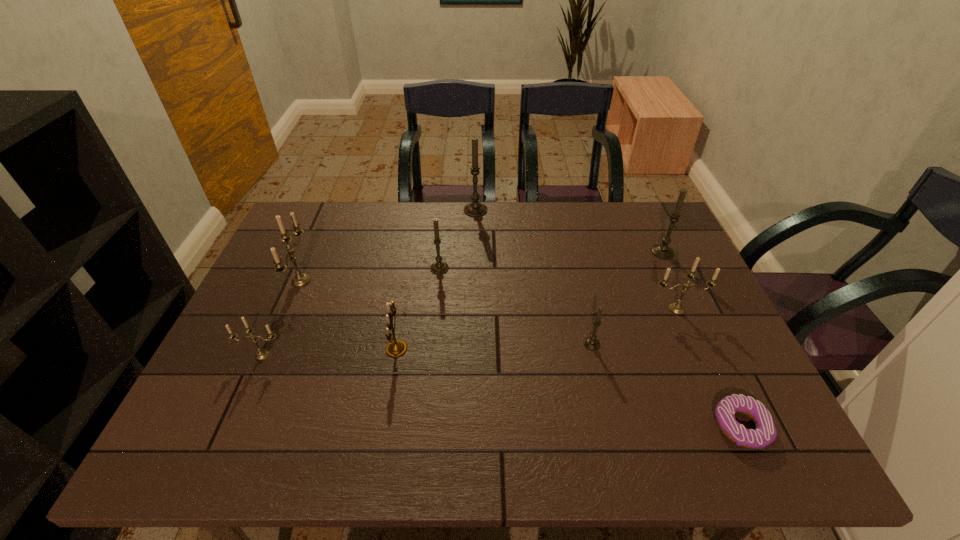
This screenshot has width=960, height=540. In order to click on the second closest gray candle to the third gray candle from left to right in this screenshot , I will do `click(439, 267)`.

At what (x,y) coordinates should I click in order to perform the action: click on the closest metallic candle to the second nearest gray candle. Please return your answer as a coordinate pair (x, y). The height and width of the screenshot is (540, 960). Looking at the image, I should click on (300, 279).

This screenshot has width=960, height=540. Find the location of `metallic candle that stands as the third closest to the candelabrum`. metallic candle that stands as the third closest to the candelabrum is located at coordinates (677, 308).

The image size is (960, 540). In order to click on vacant region that satisfies the following two spatial constraints: 1. on the back side of the candelabrum; 2. on the right side of the nearest metallic candle in this screenshot , I will do `click(265, 348)`.

This screenshot has height=540, width=960. I want to click on vacant area in the image that satisfies the following two spatial constraints: 1. on the front side of the shortest object; 2. on the right side of the biggest metallic candle, so click(238, 427).